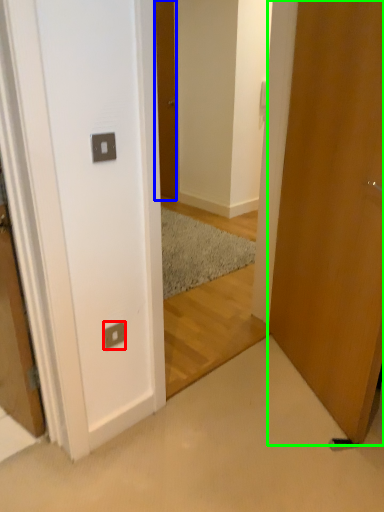
Question: Considering the real-world distances, which object is closest to electric outlet (highlighted by a red box)? door (highlighted by a blue box) or door (highlighted by a green box).

Choices:
 (A) door
 (B) door

Answer: (B)